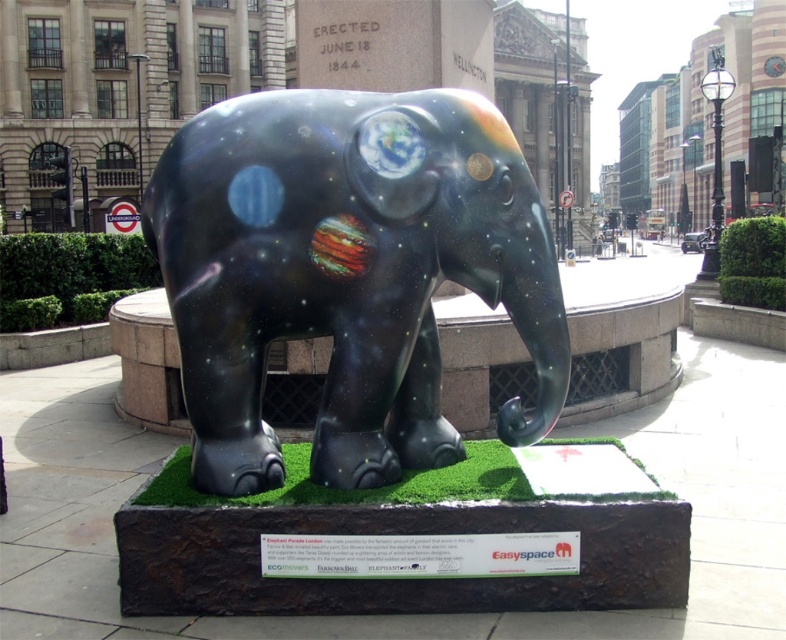
You are a city planner assessing the elephant sculpture for a new public space. Considering the glossy metallic elephant at center and the green artificial turf at center, which object is taller?

The glossy metallic elephant at center is taller than the green artificial turf at center.

You are a city planner who wants to install a new bench in the plaza. The bench needs to be placed in an area that is not covered by the glossy metallic elephant at center or the green artificial turf at center. Where should you place the bench?

The bench should be placed in an area not covered by the glossy metallic elephant at center or the green artificial turf at center, such as the surrounding stone base or the plaza ground outside the sculpture area.

You are standing in the plaza and want to take a photo of the glossy metallic elephant at center. If you are positioned at point A, which is at coordinates 0.3, 0.3, in which direction should you move to get a better view of the elephant?

The glossy metallic elephant at center is located at point [346,273]. Since you are at point [234,192], you should move northeast to get a better view of the elephant.